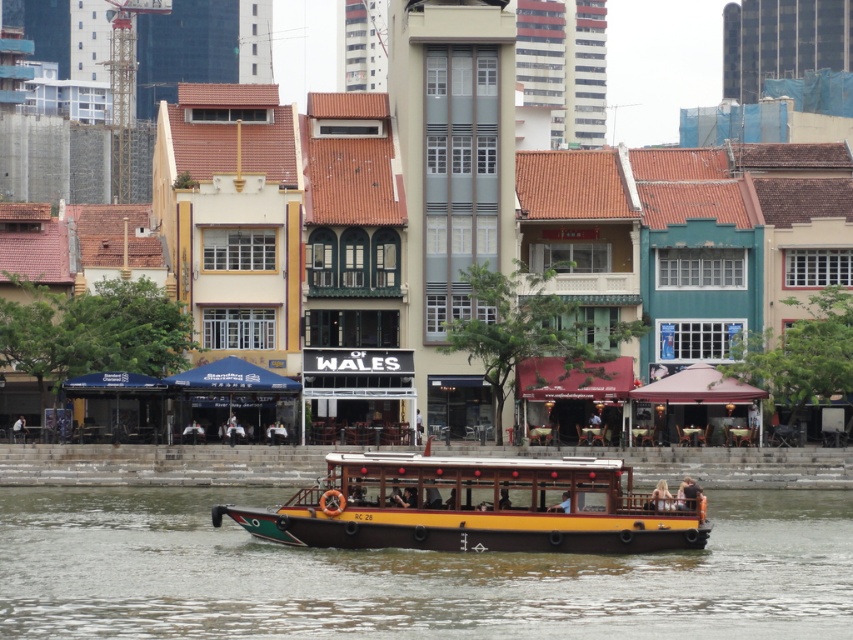
Which is above, yellow wood boat at center or wooden polished boat at center?

Positioned higher is wooden polished boat at center.

Measure the distance between yellow wood boat at center and camera.

A distance of 54.62 meters exists between yellow wood boat at center and camera.

Is point (740, 563) behind point (503, 468)?

No, it is in front of (503, 468).

The image size is (853, 640). I want to click on yellow wood boat at center, so click(407, 576).